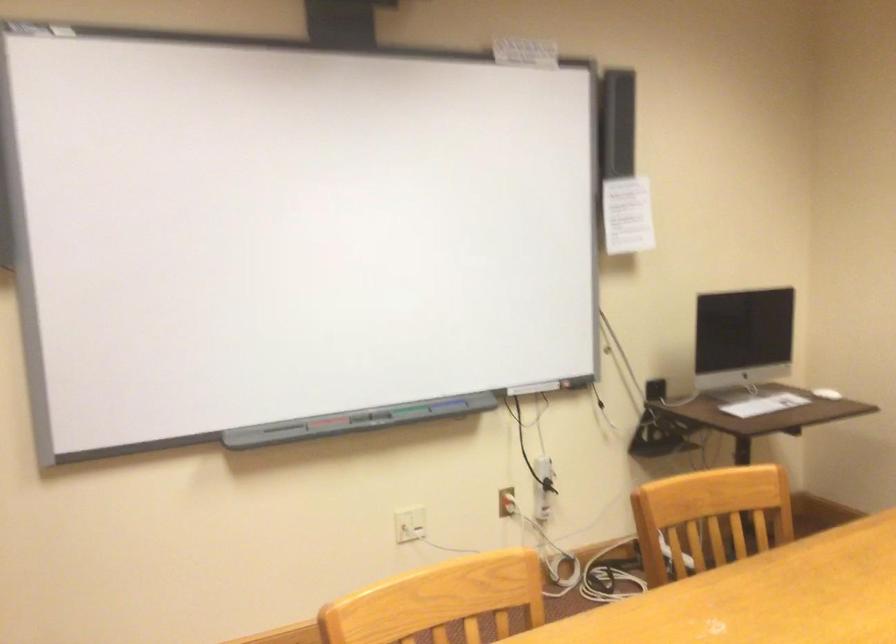
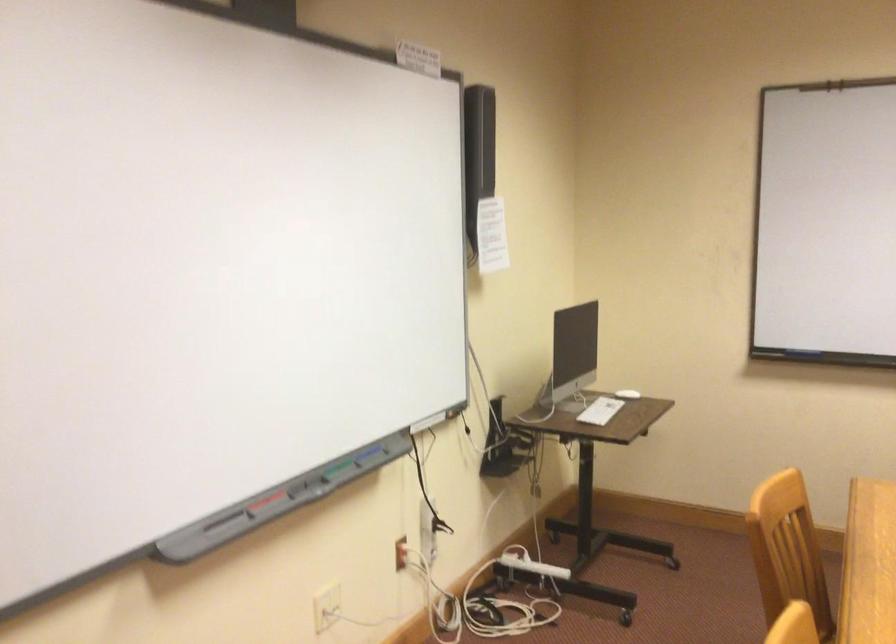
Question: I am providing you with two images of the same scene from different viewpoints. Please identify which objects are invisible in image2.

Choices:
 (A) white computer mouse
 (B) green whiteboard marker
 (C) white power strip
 (D) none of these

Answer: (D)